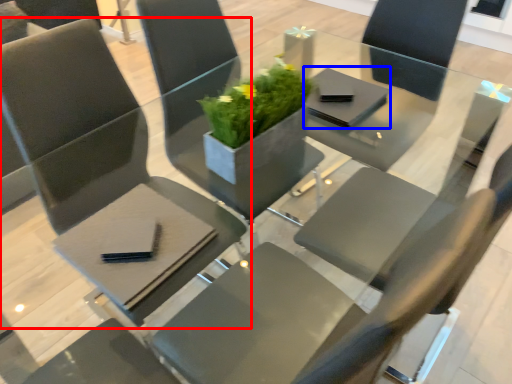
Question: Which object appears closest to the camera in this image, chair (highlighted by a red box) or pad (highlighted by a blue box)?

Choices:
 (A) chair
 (B) pad

Answer: (A)